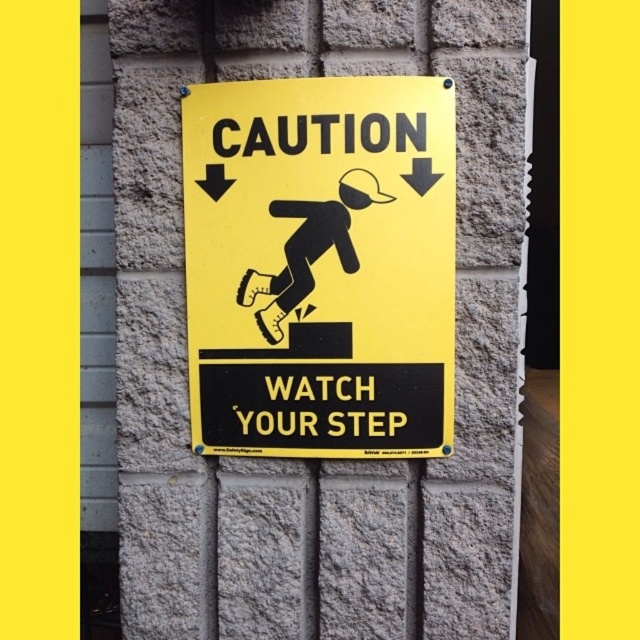
Question: Is yellow matte sign at center below black matte figure at center?

Choices:
 (A) no
 (B) yes

Answer: (B)

Question: Is yellow matte sign at center to the left of black matte figure at center from the viewer's perspective?

Choices:
 (A) yes
 (B) no

Answer: (B)

Question: Which object is closer to the camera taking this photo?

Choices:
 (A) black matte figure at center
 (B) yellow matte sign at center

Answer: (B)

Question: Where is yellow matte sign at center located in relation to black matte figure at center in the image?

Choices:
 (A) below
 (B) above

Answer: (A)